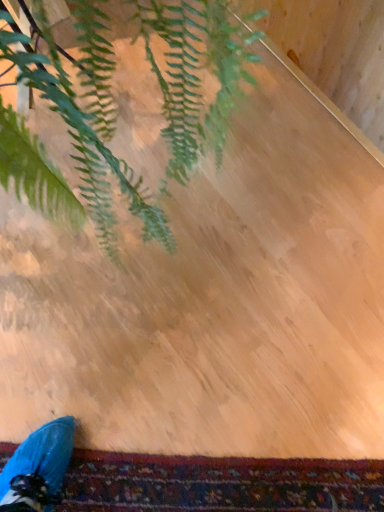
What do you see at coordinates (87, 118) in the screenshot?
I see `green leafy plant at upper left` at bounding box center [87, 118].

The image size is (384, 512). I want to click on green leafy plant at upper left, so click(87, 118).

The width and height of the screenshot is (384, 512). What are the coordinates of `green leafy plant at upper left` in the screenshot? It's located at (87, 118).